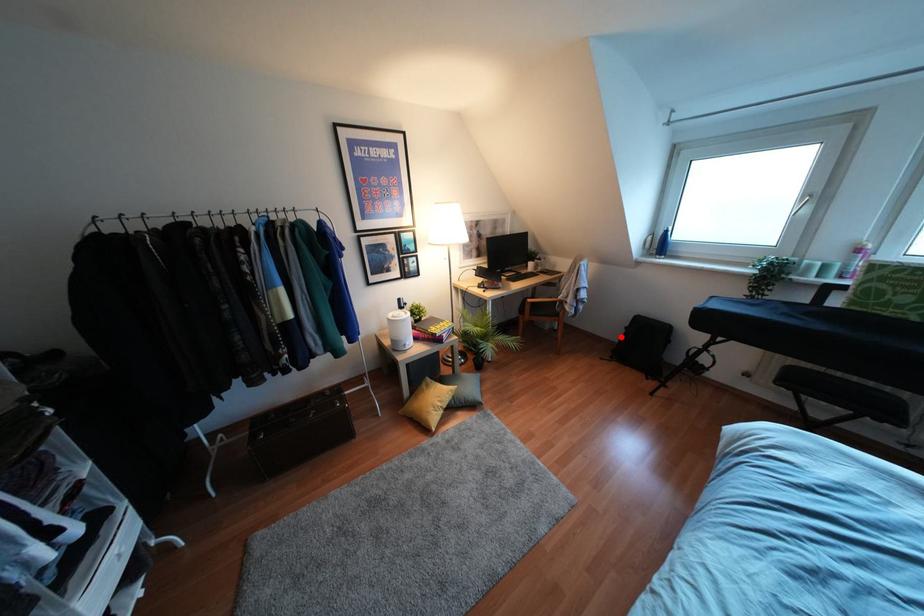
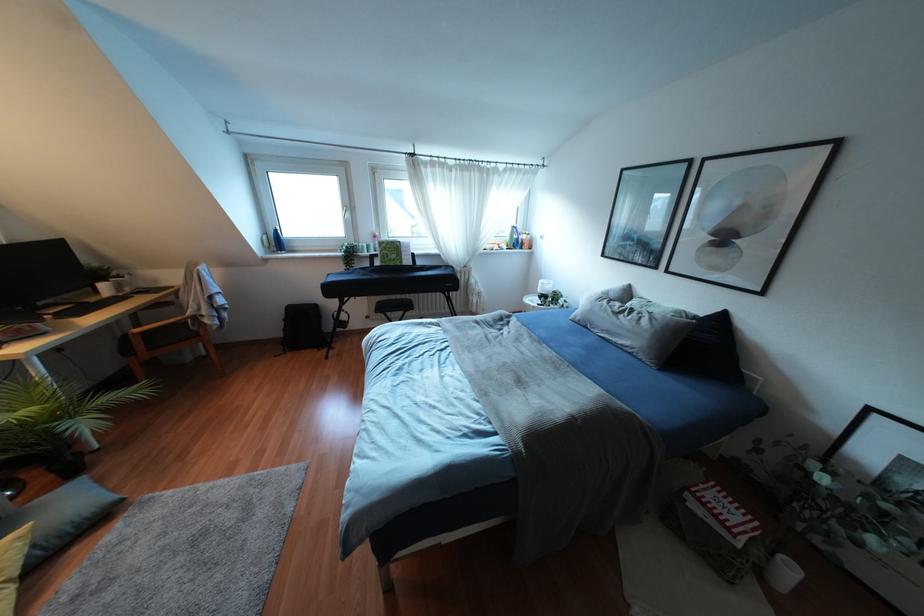
Question: I am providing you with two images of the same scene from different viewpoints. A red point is marked on the first image. At the location where the point appears in image 1, is it still visible in image 2?

Choices:
 (A) Yes
 (B) No

Answer: (A)